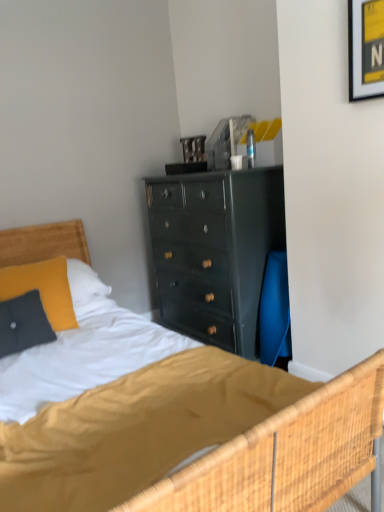
Question: From a real-world perspective, is yellow paper at upper right positioned under wooden headboard at left based on gravity?

Choices:
 (A) no
 (B) yes

Answer: (A)

Question: From the image's perspective, is yellow paper at upper right on top of wooden headboard at left?

Choices:
 (A) no
 (B) yes

Answer: (B)

Question: Does yellow paper at upper right have a greater width compared to wooden headboard at left?

Choices:
 (A) no
 (B) yes

Answer: (A)

Question: Is yellow paper at upper right positioned with its back to wooden headboard at left?

Choices:
 (A) no
 (B) yes

Answer: (A)

Question: Is yellow paper at upper right facing towards wooden headboard at left?

Choices:
 (A) no
 (B) yes

Answer: (A)

Question: Is yellow paper at upper right bigger or smaller than velvety yellow pillow at left?

Choices:
 (A) small
 (B) big

Answer: (A)

Question: Do you think yellow paper at upper right is within velvety yellow pillow at left, or outside of it?

Choices:
 (A) outside
 (B) inside

Answer: (A)

Question: Considering the relative positions of yellow paper at upper right and velvety yellow pillow at left in the image provided, is yellow paper at upper right to the left or to the right of velvety yellow pillow at left?

Choices:
 (A) left
 (B) right

Answer: (B)

Question: Is point (380, 90) positioned closer to the camera than point (31, 287)?

Choices:
 (A) farther
 (B) closer

Answer: (B)

Question: Is velvety yellow pillow at left taller or shorter than wooden headboard at left?

Choices:
 (A) short
 (B) tall

Answer: (A)

Question: Considering the positions of point (54, 295) and point (66, 241), is point (54, 295) closer or farther from the camera than point (66, 241)?

Choices:
 (A) closer
 (B) farther

Answer: (A)

Question: Based on their positions, is velvety yellow pillow at left located to the left or right of wooden headboard at left?

Choices:
 (A) right
 (B) left

Answer: (A)

Question: Is velvety yellow pillow at left inside or outside of wooden headboard at left?

Choices:
 (A) outside
 (B) inside

Answer: (B)

Question: From the image's perspective, is velvety yellow pillow at left above or below yellow paper at upper right?

Choices:
 (A) below
 (B) above

Answer: (A)

Question: Is velvety yellow pillow at left inside the boundaries of yellow paper at upper right, or outside?

Choices:
 (A) inside
 (B) outside

Answer: (B)